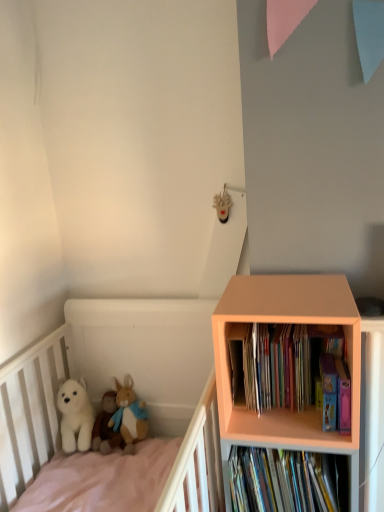
Question: Does white plush at left appear on the left side of multicolored cardboard books at right, the second book positioned from the bottom?

Choices:
 (A) no
 (B) yes

Answer: (B)

Question: Is multicolored cardboard books at right, the second book positioned from the bottom, completely or partially inside white plush at left?

Choices:
 (A) yes
 (B) no

Answer: (B)

Question: From the image's perspective, does white plush at left appear lower than multicolored cardboard books at right, the second book positioned from the bottom?

Choices:
 (A) yes
 (B) no

Answer: (A)

Question: From a real-world perspective, is white plush at left beneath multicolored cardboard books at right, the second book positioned from the bottom?

Choices:
 (A) yes
 (B) no

Answer: (A)

Question: Does white plush at left have a larger size compared to multicolored cardboard books at right, positioned as the first book in top-to-bottom order?

Choices:
 (A) yes
 (B) no

Answer: (A)

Question: Considering the relative sizes of white plush at left and multicolored cardboard books at right, positioned as the first book in top-to-bottom order, in the image provided, is white plush at left shorter than multicolored cardboard books at right, positioned as the first book in top-to-bottom order,?

Choices:
 (A) yes
 (B) no

Answer: (B)

Question: Does multicolored cardboard books at right, the second book positioned from the bottom, have a lesser width compared to peach wood bookcase at right?

Choices:
 (A) no
 (B) yes

Answer: (B)

Question: Considering the relative sizes of multicolored cardboard books at right, the second book positioned from the bottom, and peach wood bookcase at right in the image provided, is multicolored cardboard books at right, the second book positioned from the bottom, shorter than peach wood bookcase at right?

Choices:
 (A) no
 (B) yes

Answer: (B)

Question: Considering the relative sizes of multicolored cardboard books at right, positioned as the first book in top-to-bottom order, and peach wood bookcase at right in the image provided, is multicolored cardboard books at right, positioned as the first book in top-to-bottom order, bigger than peach wood bookcase at right?

Choices:
 (A) yes
 (B) no

Answer: (B)

Question: Is the depth of multicolored cardboard books at right, positioned as the first book in top-to-bottom order, greater than that of peach wood bookcase at right?

Choices:
 (A) no
 (B) yes

Answer: (B)

Question: Would you consider multicolored cardboard books at right, the second book positioned from the bottom, to be distant from peach wood bookcase at right?

Choices:
 (A) no
 (B) yes

Answer: (A)

Question: From the image's perspective, does multicolored cardboard books at right, the second book positioned from the bottom, appear higher than peach wood bookcase at right?

Choices:
 (A) yes
 (B) no

Answer: (A)

Question: Does white plush dog at lower left appear on the right side of white plush at left?

Choices:
 (A) yes
 (B) no

Answer: (B)